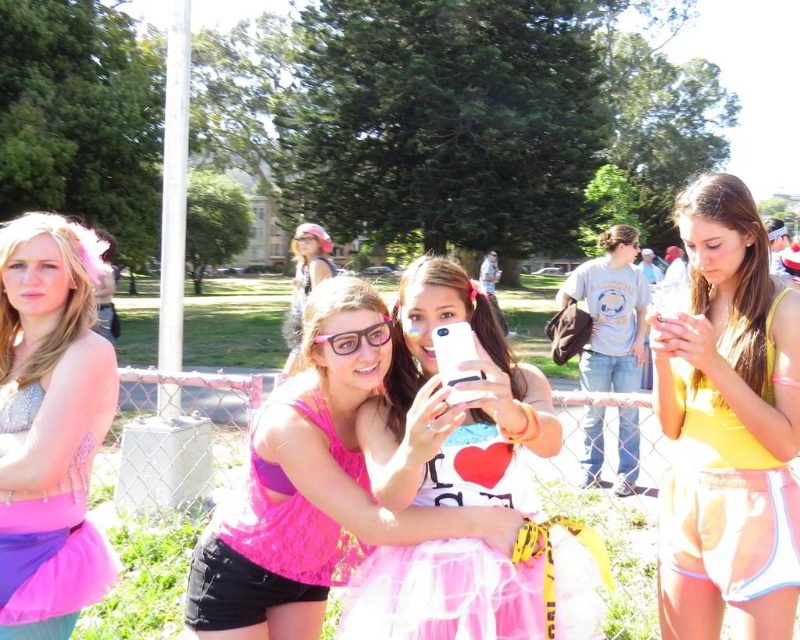
You are a photographer at the festival and want to capture a photo where both the yellow fabric shorts at center and the pink fabric dress at center are visible. Based on their positions, which one will appear lower in the photo?

The yellow fabric shorts at center will appear lower in the photo because it is positioned under the pink fabric dress at center.

You are a photographer trying to capture the pink tulle skirt at center in a photo. The camera you are using has a focus point at coordinates 0.6, 0.5. Will the skirt be in focus?

The pink tulle skirt at center is located at point (452,404), which is close to the camera focus point at (400,384). Therefore, the skirt will likely be in focus.